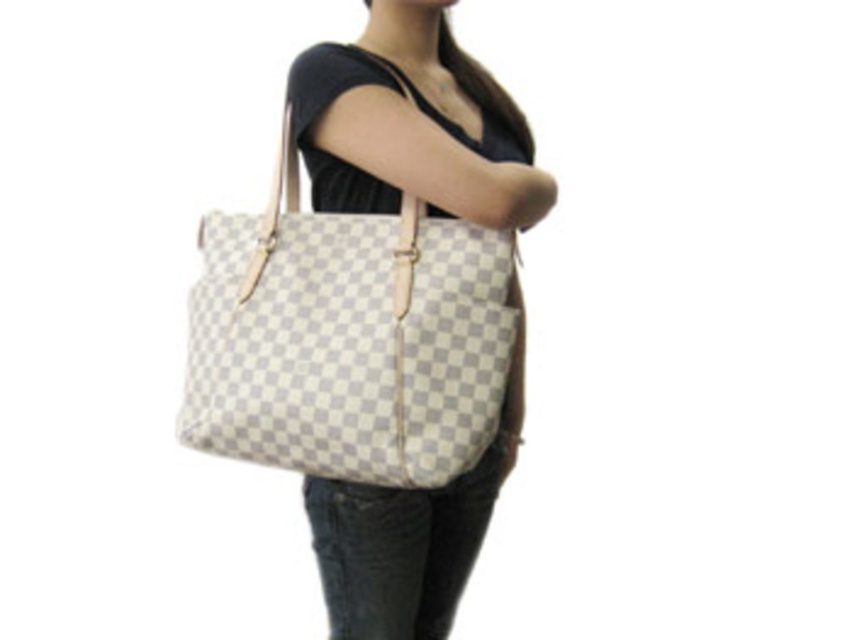
Question: Is the position of white checkered fabric tote at center less distant than that of white checkered bag at center?

Choices:
 (A) no
 (B) yes

Answer: (A)

Question: Observing the image, what is the correct spatial positioning of white checkered fabric tote at center in reference to white checkered bag at center?

Choices:
 (A) left
 (B) right

Answer: (A)

Question: Estimate the real-world distances between objects in this image. Which object is closer to the white checkered fabric tote at center?

Choices:
 (A) denim at lower center
 (B) white checkered bag at center

Answer: (B)

Question: Which point is farther from the camera taking this photo?

Choices:
 (A) (456, 205)
 (B) (398, 534)

Answer: (B)

Question: Where is white checkered fabric tote at center located in relation to denim at lower center in the image?

Choices:
 (A) above
 (B) below

Answer: (A)

Question: Which point is farther from the camera taking this photo?

Choices:
 (A) (256, 240)
 (B) (332, 74)
 (C) (327, 570)

Answer: (C)